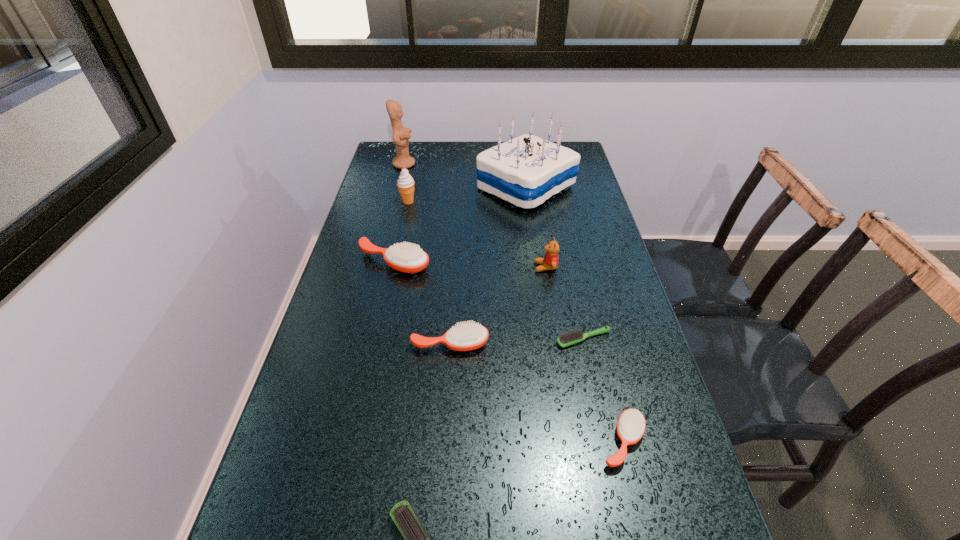
Locate which object ranks third in proximity to the smallest orange hairbrush. Please provide its 2D coordinates. Your answer should be formatted as a tuple, i.e. [(x, y)], where the tuple contains the x and y coordinates of a point satisfying the conditions above.

[(403, 516)]

This screenshot has width=960, height=540. I want to click on the third closest object to the rightmost orange hairbrush, so click(x=403, y=516).

Where is `hairbrush that stands as the closest to the left light hairbrush`? hairbrush that stands as the closest to the left light hairbrush is located at coordinates (631, 424).

This screenshot has height=540, width=960. What are the coordinates of `hairbrush that is the closest to the second biggest orange hairbrush` in the screenshot? It's located at (565, 340).

Select which orange hairbrush appears as the closest to the fourth shortest object. Please provide its 2D coordinates. Your answer should be formatted as a tuple, i.e. [(x, y)], where the tuple contains the x and y coordinates of a point satisfying the conditions above.

[(408, 258)]

Select which orange hairbrush appears as the second closest to the third tallest object. Please provide its 2D coordinates. Your answer should be formatted as a tuple, i.e. [(x, y)], where the tuple contains the x and y coordinates of a point satisfying the conditions above.

[(469, 336)]

I want to click on vacant position in the image that satisfies the following two spatial constraints: 1. on the front-facing side of the second nearest hairbrush; 2. on the right side of the figurine, so click(x=334, y=441).

This screenshot has width=960, height=540. I want to click on vacant area that satisfies the following two spatial constraints: 1. on the back side of the fourth shortest object; 2. on the front-facing side of the figurine, so click(461, 164).

This screenshot has width=960, height=540. I want to click on vacant region that satisfies the following two spatial constraints: 1. on the front-facing side of the farthest hairbrush; 2. on the right side of the figurine, so click(379, 262).